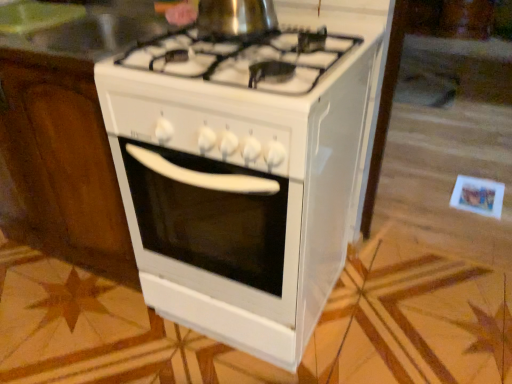
Locate an element on the screen. The width and height of the screenshot is (512, 384). white glossy oven at center is located at coordinates (247, 170).

Measure the distance between white glossy oven at center and camera.

white glossy oven at center and camera are 29.69 inches apart from each other.

Describe the element at coordinates (247, 170) in the screenshot. I see `white glossy oven at center` at that location.

You are a GUI agent. You are given a task and a screenshot of the screen. Output one action in this format:
    pyautogui.click(x=<x>, y=<y>)
    Task: Click on the white glossy oven at center
    
    Given the screenshot: What is the action you would take?
    pyautogui.click(x=247, y=170)